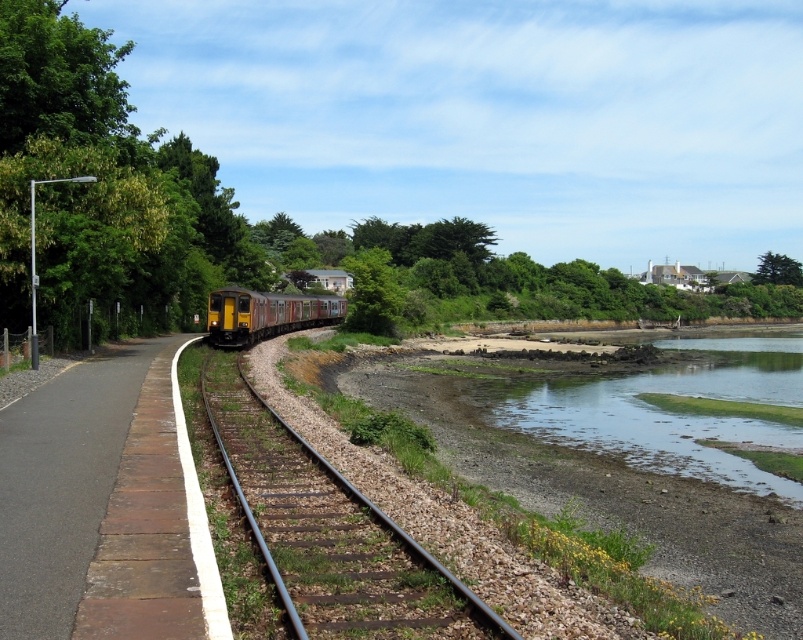
Is green leafy tree at center bigger than green leafy tree at upper right?

No, green leafy tree at center is not bigger than green leafy tree at upper right.

Is point (369, 260) positioned after point (783, 260)?

No, it is in front of (783, 260).

Find the location of `green leafy tree at center`. green leafy tree at center is located at coordinates (373, 292).

Can you confirm if metallic brown train track at center is taller than yellow metallic train at center?

No, metallic brown train track at center is not taller than yellow metallic train at center.

Can you confirm if metallic brown train track at center is smaller than yellow metallic train at center?

Indeed, metallic brown train track at center has a smaller size compared to yellow metallic train at center.

Between point (321, 506) and point (292, 312), which one is positioned behind?

The point (292, 312) is behind.

This screenshot has width=803, height=640. I want to click on metallic brown train track at center, so click(x=329, y=531).

Between metallic brown train track at center and green leafy tree at center, which one appears on the left side from the viewer's perspective?

Positioned to the left is green leafy tree at center.

Who is higher up, metallic brown train track at center or green leafy tree at center?

green leafy tree at center is above.

Is point (304, 582) positioned behind point (378, 269)?

No, it is not.

Locate an element on the screen. This screenshot has height=640, width=803. metallic brown train track at center is located at coordinates (329, 531).